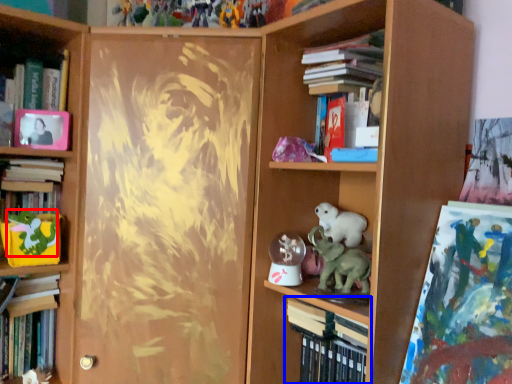
Question: Which of the following is the farthest to the observer, animal (highlighted by a red box) or book (highlighted by a blue box)?

Choices:
 (A) animal
 (B) book

Answer: (A)